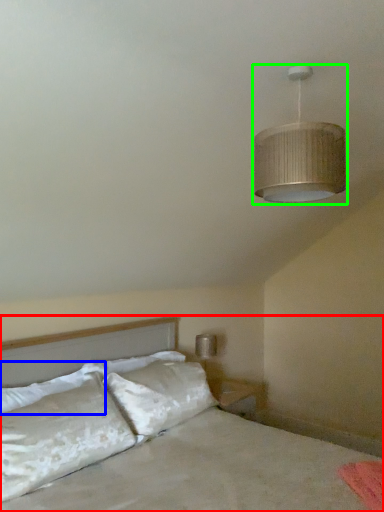
Question: Which object is positioned farthest from bed (highlighted by a red box)? Select from pillow (highlighted by a blue box) and lamp (highlighted by a green box).

Choices:
 (A) pillow
 (B) lamp

Answer: (B)